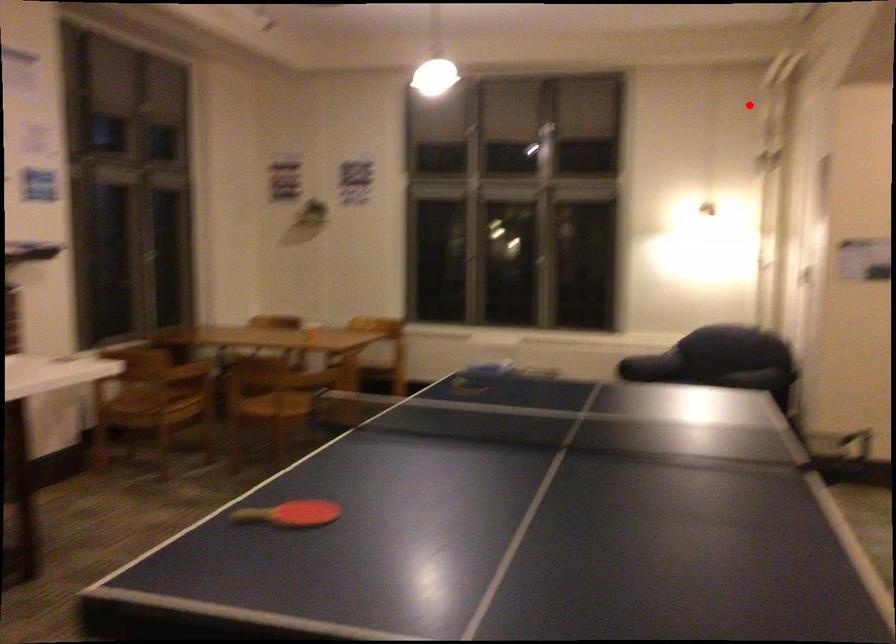
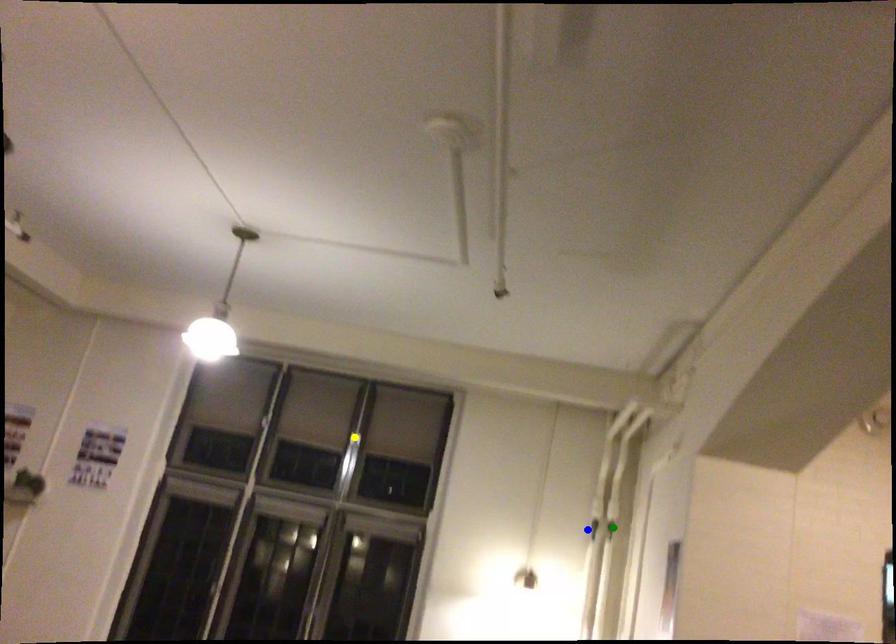
Question: I am providing you with two images of the same scene from different viewpoints. A red point is marked on the first image. You are given multiple points on the second image. Which point in image 2 is actually the same real-world point as the red point in image 1?

Choices:
 (A) yellow point
 (B) green point
 (C) blue point

Answer: (B)